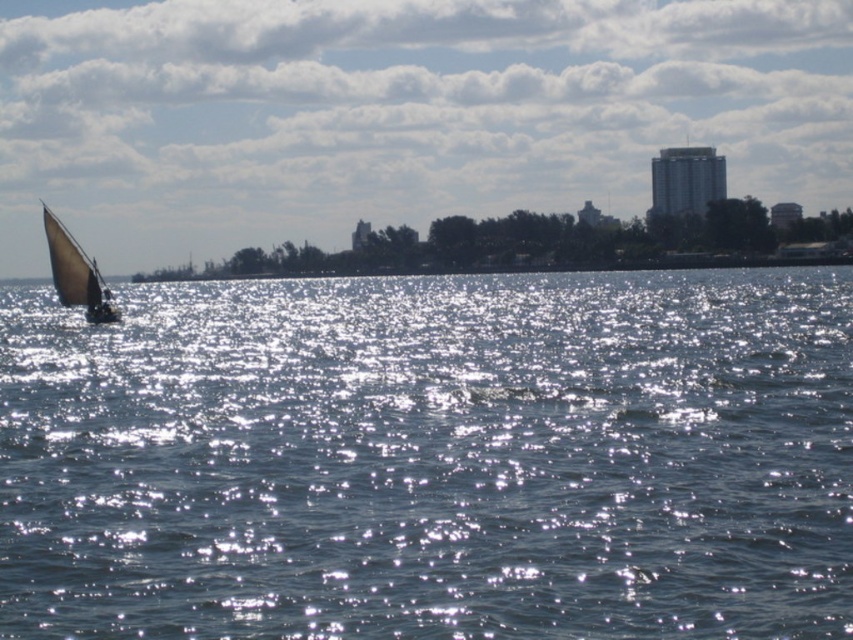
You are standing on the shore looking at the blue water at left and the white canvas sail at left. Which object appears wider in the image?

The blue water at left appears wider than the white canvas sail at left because its width is larger according to the description.

You are standing on the shore looking at the blue water at left and the matte white sailboat at left. Which object appears taller from your viewpoint?

The matte white sailboat at left appears taller than the blue water at left from your viewpoint.

You are an observer standing on the shore looking out at the seascape. You notice the matte white sailboat at left and the white canvas sail at left. Which object is wider from your perspective?

The matte white sailboat at left is wider than the white canvas sail at left according to the description.